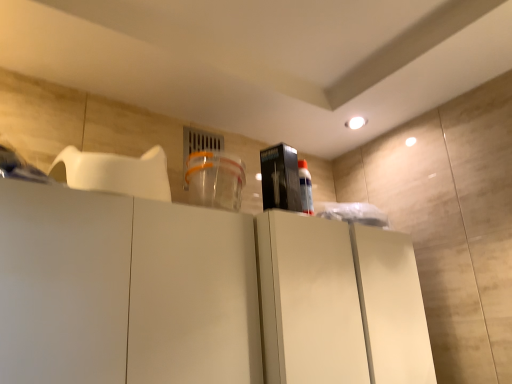
Question: Can you see matte white cabinet at center touching black plastic box at center?

Choices:
 (A) yes
 (B) no

Answer: (B)

Question: From the image's perspective, is matte white cabinet at center below black plastic box at center?

Choices:
 (A) no
 (B) yes

Answer: (B)

Question: Is matte white cabinet at center thinner than black plastic box at center?

Choices:
 (A) yes
 (B) no

Answer: (B)

Question: Does matte white cabinet at center contain black plastic box at center?

Choices:
 (A) yes
 (B) no

Answer: (B)

Question: Considering the relative sizes of matte white cabinet at center and black plastic box at center in the image provided, is matte white cabinet at center shorter than black plastic box at center?

Choices:
 (A) yes
 (B) no

Answer: (B)

Question: From the image's perspective, is matte white cabinet at center located above black plastic box at center?

Choices:
 (A) no
 (B) yes

Answer: (A)

Question: Is black plastic box at center positioned behind matte white cabinet at center?

Choices:
 (A) no
 (B) yes

Answer: (B)

Question: Considering the relative positions of black plastic box at center and matte white cabinet at center in the image provided, is black plastic box at center to the left of matte white cabinet at center from the viewer's perspective?

Choices:
 (A) no
 (B) yes

Answer: (B)

Question: Considering the relative sizes of black plastic box at center and matte white cabinet at center in the image provided, is black plastic box at center thinner than matte white cabinet at center?

Choices:
 (A) no
 (B) yes

Answer: (B)

Question: From a real-world perspective, is black plastic box at center on matte white cabinet at center?

Choices:
 (A) no
 (B) yes

Answer: (B)

Question: From the image's perspective, would you say black plastic box at center is shown under matte white cabinet at center?

Choices:
 (A) no
 (B) yes

Answer: (A)

Question: Does black plastic box at center have a larger size compared to matte white cabinet at center?

Choices:
 (A) yes
 (B) no

Answer: (B)

Question: In the image, is matte white cabinet at center positioned in front of or behind black plastic box at center?

Choices:
 (A) front
 (B) behind

Answer: (A)